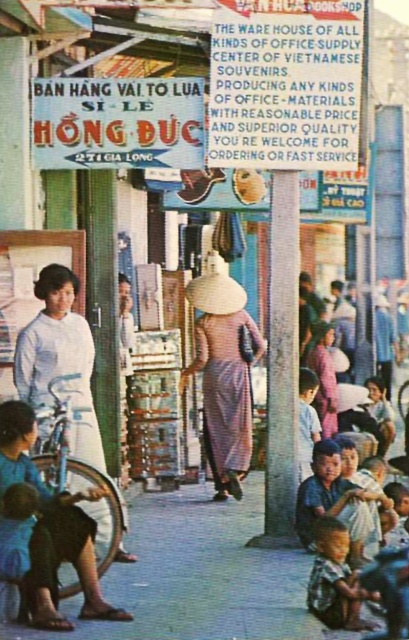
Based on the scene description, where is the matte purple dress at center located in terms of coordinates?

The matte purple dress at center is located at coordinates point [224,376].

You are a fashion designer observing the bustling Vietnamese market scene. You notice two outfits in the crowd. The first is a blue cotton shirt at lower left, and the second is a matte purple dress at center. Which of these two outfits has a wider silhouette?

The blue cotton shirt at lower left has a wider silhouette than the matte purple dress at center, as its width surpasses that of the dress.

You are a photographer standing in the Vietnamese market scene. You want to take a photo that includes both the blue cotton shirt at lower left and the matte purple dress at center. Which object should you position closer to the left side of your camera frame?

The blue cotton shirt at lower left should be positioned closer to the left side of your camera frame since it is already located to the left of the matte purple dress at center in the scene.